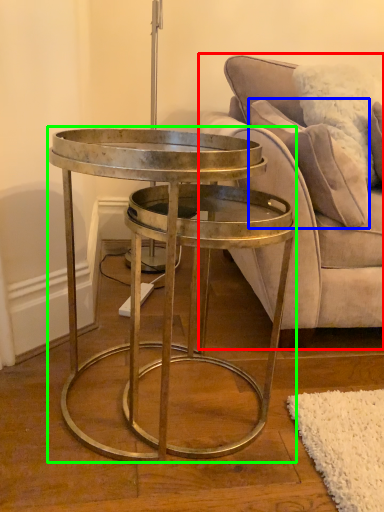
Question: Which object is the farthest from studio couch (highlighted by a red box)? Choose among these: pillow (highlighted by a blue box) or coffee table (highlighted by a green box).

Choices:
 (A) pillow
 (B) coffee table

Answer: (B)